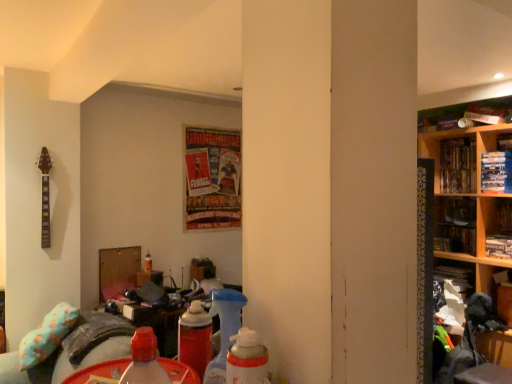
Question: Looking at the image, does wooden shelves at right seem bigger or smaller compared to translucent plastic bottle at center, arranged as the 2th bottle when viewed from the front?

Choices:
 (A) small
 (B) big

Answer: (B)

Question: From a real-world perspective, relative to translucent plastic bottle at center, which is counted as the 1th bottle, starting from the bottom, is wooden shelves at right vertically above or below?

Choices:
 (A) above
 (B) below

Answer: (A)

Question: Which object is positioned closest to the shiny plastic dvd case at upper right, which is counted as the second book, starting from the left?

Choices:
 (A) hardcover book at right, the first book when ordered from right to left
 (B) shiny paper poster at center, positioned as the first book in left-to-right order
 (C) wooden shelves at right
 (D) translucent plastic bottle at center, arranged as the 2th bottle when viewed from the front
 (E) hardcover book at upper right, marked as the 3th book in a left-to-right arrangement

Answer: (C)

Question: Estimate the real-world distances between objects in this image. Which object is closer to the hardcover book at right, the first book when ordered from right to left?

Choices:
 (A) shiny paper poster at center, positioned as the first book in left-to-right order
 (B) shiny plastic dvd case at upper right, which is counted as the second book, starting from the left
 (C) fluffy teal pillow at lower left
 (D) hardcover books at upper right, the 4th book from the left
 (E) translucent plastic bottle at center, which is counted as the 1th bottle, starting from the bottom

Answer: (D)